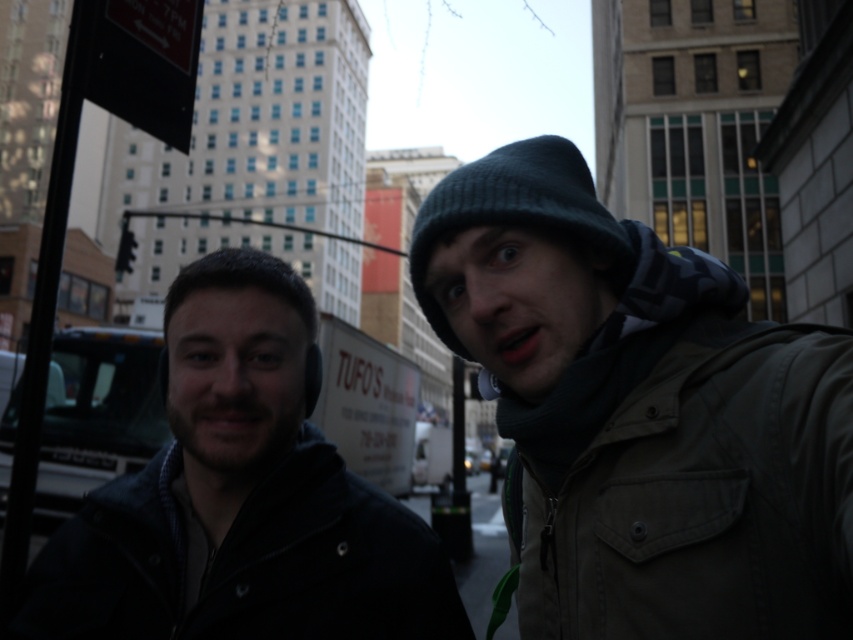
You are a photographer trying to capture the knit cap at upper right in the image. The coordinates given are in a normalized format where the top left corner is the origin. Based on the coordinates point [642,413], can you determine the position of the knit cap relative to the two people in the scene?

The point [642,413] corresponds to the knit cap at upper right. Since the coordinates are normalized with the origin at the top left, the x value of 0.647 places it towards the right side and the y value of 0.754 places it towards the upper part of the image. Therefore, the knit cap at upper right is positioned above and to the right of the two people standing in the scene.

You are a photographer trying to capture a wide shot of the dark blue jacket at center and the black knit hat at upper right. Which object will appear smaller in the photo?

The dark blue jacket at center will appear smaller in the photo because it occupies less space than the black knit hat at upper right.